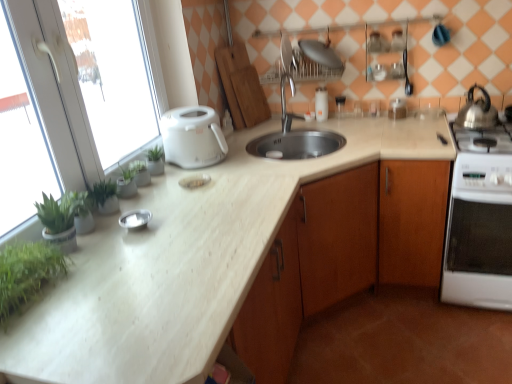
This screenshot has width=512, height=384. Find the location of `free space to the right of green leafy plant at left`. free space to the right of green leafy plant at left is located at coordinates (236, 179).